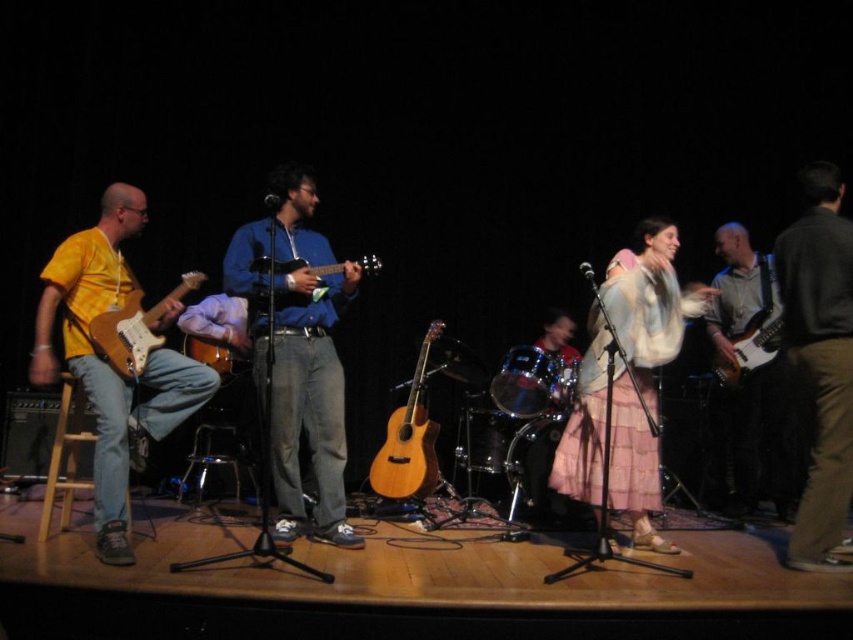
Question: Estimate the real-world distances between objects in this image. Which object is closer to the natural wood acoustic guitar at center?

Choices:
 (A) matte brown acoustic guitar at left
 (B) electric wood guitar at right
 (C) fuzzy white scarf at center
 (D) wooden acoustic guitar at center

Answer: (A)

Question: From the image, what is the correct spatial relationship of matte yellow electric guitar at left in relation to electric wood guitar at right?

Choices:
 (A) below
 (B) above

Answer: (B)

Question: Which object appears farthest from the camera in this image?

Choices:
 (A) wooden acoustic guitar at center
 (B) matte yellow electric guitar at left
 (C) electric wood guitar at right

Answer: (C)

Question: Is fuzzy white scarf at center positioned behind electric wood guitar at right?

Choices:
 (A) yes
 (B) no

Answer: (B)

Question: Is yellow matte guitar at left below dark gray sweater at right?

Choices:
 (A) yes
 (B) no

Answer: (A)

Question: Which object is farther from the camera taking this photo?

Choices:
 (A) natural wood acoustic guitar at center
 (B) brown glossy electric guitar at right
 (C) dark gray sweater at right

Answer: (A)